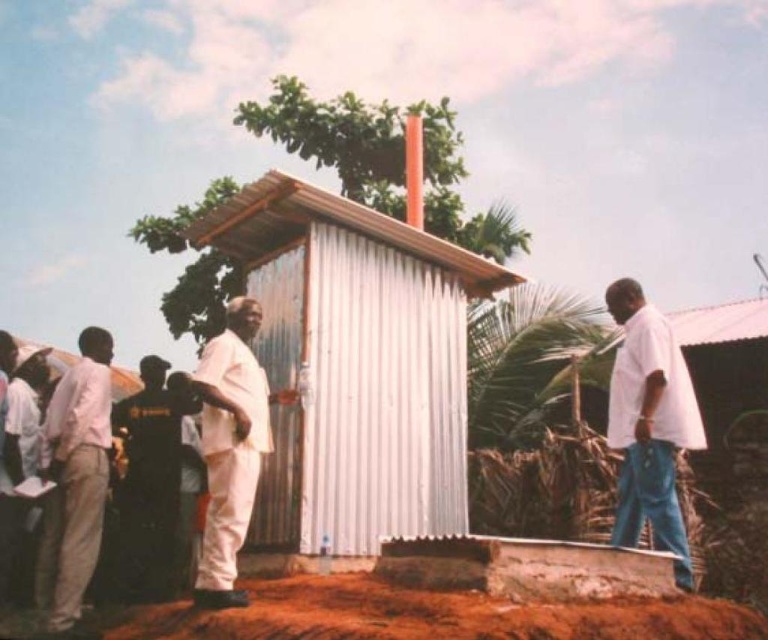
You are a photographer trying to capture a group photo of the people near the latrine. You notice the white cotton shirt at right and the white matte suit at center. Which person should you ask to move forward so that both are in focus?

The white cotton shirt at right is shorter than the white matte suit at center. To ensure both are in focus, ask the person in the white cotton shirt at right to move forward so their height aligns with the taller individual in the white matte suit at center.

You are a photographer trying to capture a group photo of the people in front of the latrine structure. You notice the white cotton shirt at right and the white matte suit at center. Which person should you move forward to ensure both are visible in the frame?

The white matte suit at center is behind the white cotton shirt at right, so you should move the white matte suit at center forward to ensure both are visible in the frame.

You are a construction worker assessing the site. You see the white corrugated metal hut at center and the light beige pants at left. Which object is taller?

The white corrugated metal hut at center is taller than the light beige pants at left.